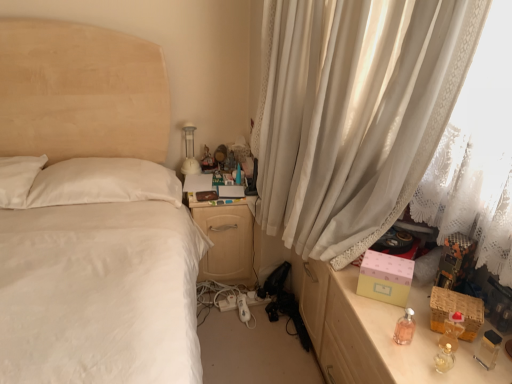
Where is `free spot above light wood/wooden nightstand at center (from a real-world perspective)`? The width and height of the screenshot is (512, 384). free spot above light wood/wooden nightstand at center (from a real-world perspective) is located at coordinates (211, 178).